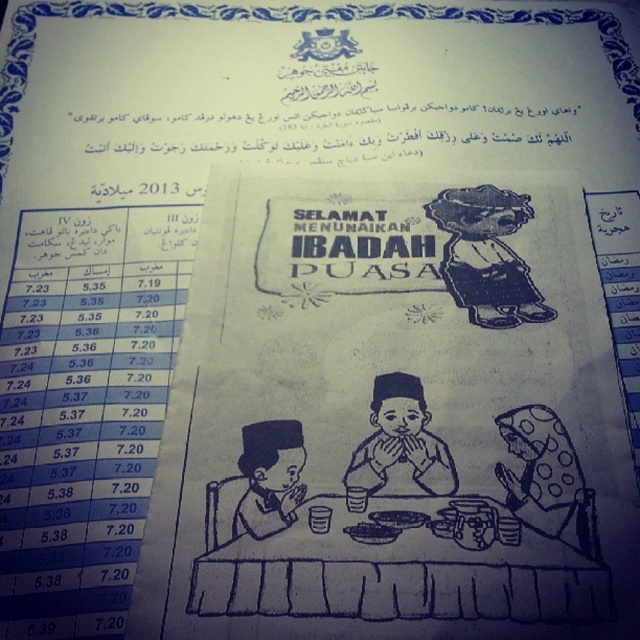
Which is below, black paper table at center or dark brown matte plate at center?

Positioned lower is black paper table at center.

Which of these two, black paper table at center or dark brown matte plate at center, stands taller?

With more height is black paper table at center.

Is point (506, 529) positioned in front of point (426, 518)?

Yes.

Locate an element on the screen. black paper table at center is located at coordinates (404, 568).

Can you confirm if black paper table at center is positioned below polka dot fabric headscarf at lower right?

Correct, black paper table at center is located below polka dot fabric headscarf at lower right.

Is point (460, 598) in front of point (538, 458)?

Yes, point (460, 598) is closer to viewer.

Identify the location of black paper table at center. The width and height of the screenshot is (640, 640). (404, 568).

Does polka dot fabric headscarf at lower right have a larger size compared to matte plastic plate at center?

Indeed, polka dot fabric headscarf at lower right has a larger size compared to matte plastic plate at center.

What do you see at coordinates (547, 477) in the screenshot?
I see `polka dot fabric headscarf at lower right` at bounding box center [547, 477].

The height and width of the screenshot is (640, 640). What are the coordinates of `polka dot fabric headscarf at lower right` in the screenshot? It's located at (547, 477).